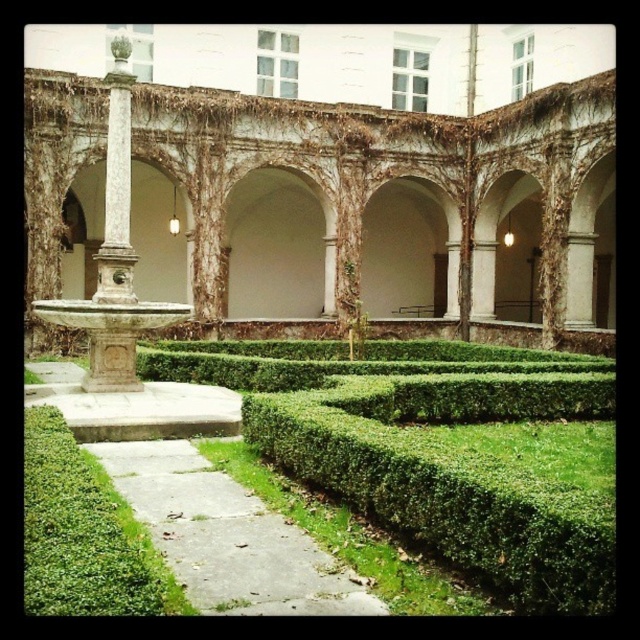
Which is behind, point (134, 228) or point (282, 253)?

Positioned behind is point (282, 253).

Is white stone fountain at center further to camera compared to white stone archway at center?

No, it is not.

Is point (288, 164) farther from viewer compared to point (317, 241)?

No, (288, 164) is in front of (317, 241).

I want to click on white stone fountain at center, so click(324, 157).

Who is positioned more to the left, green hedge at center or white stone archway at center?

Positioned to the left is white stone archway at center.

Is green hedge at center to the left of white stone archway at center from the viewer's perspective?

Incorrect, green hedge at center is not on the left side of white stone archway at center.

This screenshot has height=640, width=640. What do you see at coordinates (428, 449) in the screenshot? I see `green hedge at center` at bounding box center [428, 449].

Where is `green hedge at center`? The height and width of the screenshot is (640, 640). green hedge at center is located at coordinates (428, 449).

Between white stone fountain at center and green hedge at center, which one is positioned higher?

white stone fountain at center is higher up.

Is white stone fountain at center to the left of green hedge at center from the viewer's perspective?

No, white stone fountain at center is not to the left of green hedge at center.

Is point (525, 52) positioned after point (554, 572)?

Yes, point (525, 52) is farther from viewer.

At what (x,y) coordinates should I click in order to perform the action: click on white stone fountain at center. Please return your answer as a coordinate pair (x, y). Looking at the image, I should click on (324, 157).